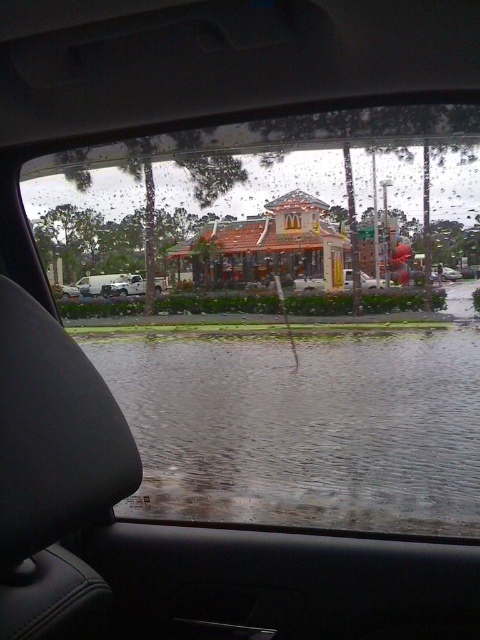
Who is positioned more to the left, transparent glass car window at center or clear water at lower center?

clear water at lower center

Between point (374, 332) and point (106, 355), which one is positioned in front?

Point (106, 355)

This screenshot has width=480, height=640. What are the coordinates of `transparent glass car window at center` in the screenshot? It's located at (288, 314).

The width and height of the screenshot is (480, 640). Identify the location of transparent glass car window at center. (288, 314).

Can you confirm if clear water at lower center is positioned to the left of white matte truck at lower left?

No, clear water at lower center is not to the left of white matte truck at lower left.

Locate an element on the screen. clear water at lower center is located at coordinates (303, 429).

Does point (224, 522) come in front of point (104, 291)?

That is True.

Find the location of a particular element. clear water at lower center is located at coordinates (303, 429).

Who is taller, transparent glass car window at center or white matte truck at lower left?

With more height is transparent glass car window at center.

This screenshot has height=640, width=480. What are the coordinates of `transparent glass car window at center` in the screenshot? It's located at (288, 314).

Image resolution: width=480 pixels, height=640 pixels. What do you see at coordinates (288, 314) in the screenshot? I see `transparent glass car window at center` at bounding box center [288, 314].

Locate an element on the screen. This screenshot has height=640, width=480. transparent glass car window at center is located at coordinates (288, 314).